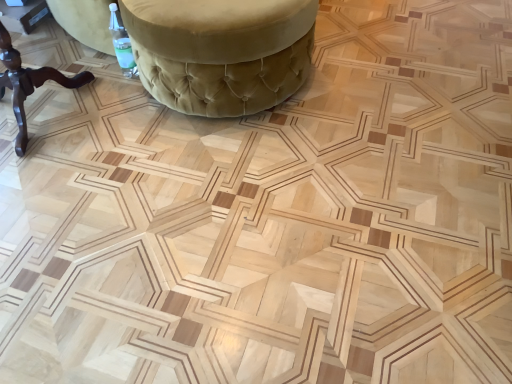
You are a GUI agent. You are given a task and a screenshot of the screen. Output one action in this format:
    pyautogui.click(x=<x>, y=<y>)
    Task: Click on the vacant space in front of brown wooden table at left, the 2th furniture viewed from the right
    This screenshot has width=512, height=384.
    Given the screenshot: What is the action you would take?
    pyautogui.click(x=59, y=201)